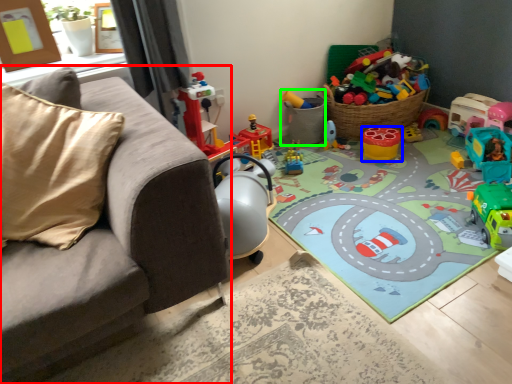
Question: Which object is positioned closest to studio couch (highlighted by a red box)? Select from toy (highlighted by a blue box) and toy (highlighted by a green box).

Choices:
 (A) toy
 (B) toy

Answer: (B)